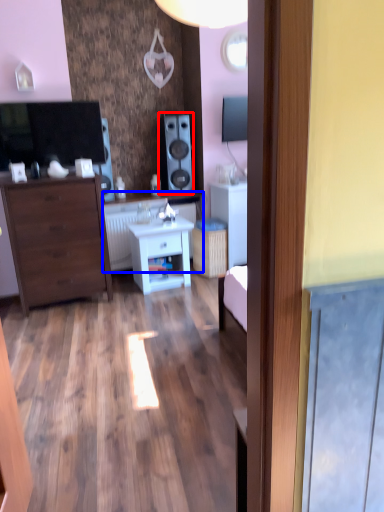
Question: Which object appears closest to the camera in this image, speaker (highlighted by a red box) or counter top (highlighted by a blue box)?

Choices:
 (A) speaker
 (B) counter top

Answer: (B)